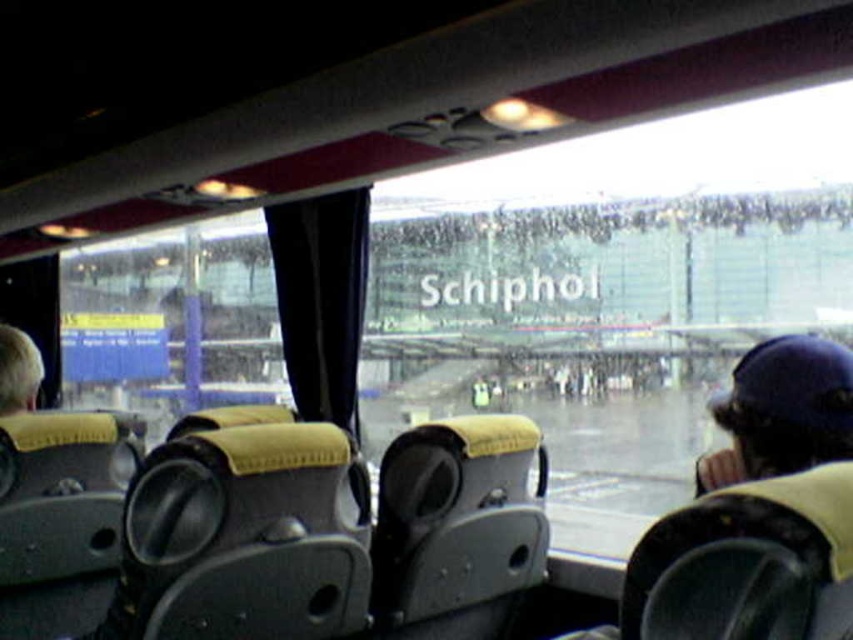
Does blue fabric cap at right have a greater height compared to blonde hair at lower left?

Correct, blue fabric cap at right is much taller as blonde hair at lower left.

Between blue fabric cap at right and blonde hair at lower left, which one is positioned higher?

blonde hair at lower left

At what (x,y) coordinates should I click in order to perform the action: click on blue fabric cap at right. Please return your answer as a coordinate pair (x, y). The width and height of the screenshot is (853, 640). Looking at the image, I should click on (781, 412).